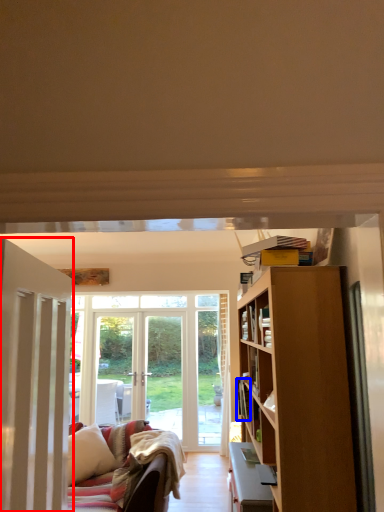
Question: Which object is closer to the camera taking this photo, door (highlighted by a red box) or book (highlighted by a blue box)?

Choices:
 (A) door
 (B) book

Answer: (A)